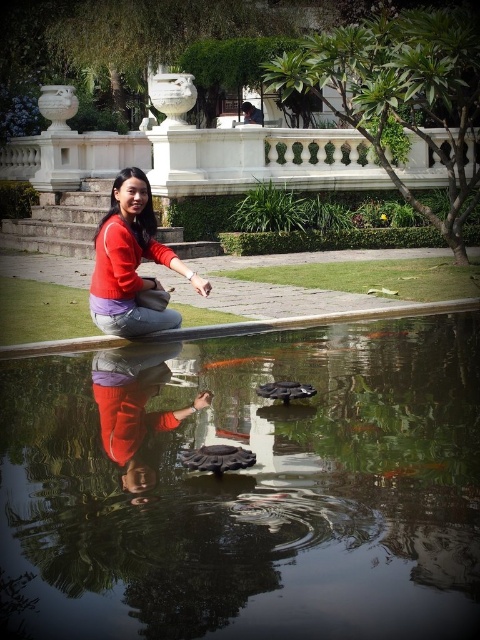
Question: Which of the following is the closest to the observer?

Choices:
 (A) (8, 428)
 (B) (123, 330)

Answer: (A)

Question: Which of the following is the closest to the observer?

Choices:
 (A) matte red sweater at center
 (B) matte red pants at center

Answer: (B)

Question: Does matte red sweater at center have a smaller size compared to matte red pants at center?

Choices:
 (A) no
 (B) yes

Answer: (B)

Question: Is transparent glass fish pond at center thinner than matte red pants at center?

Choices:
 (A) yes
 (B) no

Answer: (A)

Question: Can you confirm if transparent glass fish pond at center is positioned below matte red sweater at center?

Choices:
 (A) no
 (B) yes

Answer: (B)

Question: Which of these objects is positioned closest to the matte red pants at center?

Choices:
 (A) transparent glass fish pond at center
 (B) matte red sweater at center

Answer: (B)